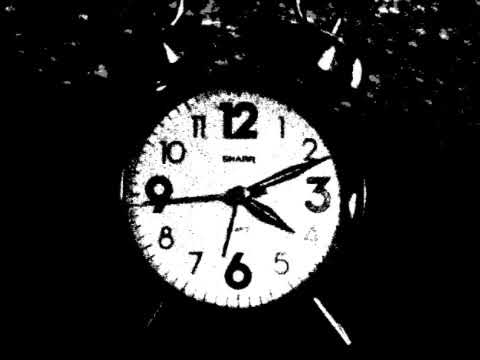
The height and width of the screenshot is (360, 480). I want to click on clock hands, so click(278, 221), click(267, 180), click(208, 196), click(230, 228).